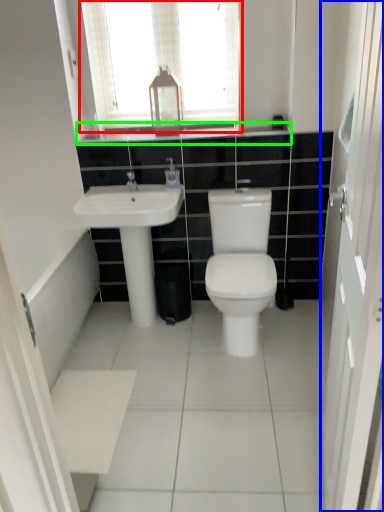
Question: Considering the real-world distances, which object is farthest from window (highlighted by a red box)? screen door (highlighted by a blue box) or counter top (highlighted by a green box)?

Choices:
 (A) screen door
 (B) counter top

Answer: (A)